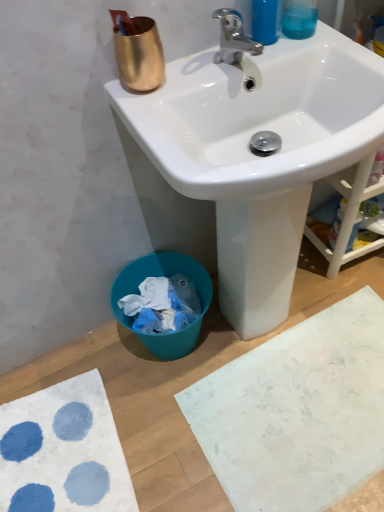
Question: Choose the correct answer: Is white textured bath mat at lower left, positioned as the second bath mat in right-to-left order, inside translucent blue liquid at upper right or outside it?

Choices:
 (A) inside
 (B) outside

Answer: (B)

Question: In terms of size, does white textured bath mat at lower left, positioned as the second bath mat in right-to-left order, appear bigger or smaller than translucent blue liquid at upper right?

Choices:
 (A) small
 (B) big

Answer: (B)

Question: Based on their relative distances, which object is farther from the white glossy sink at upper center?

Choices:
 (A) chrome metallic faucet at upper center
 (B) white textured bath mat at lower left, marked as the first bath mat in a left-to-right arrangement
 (C) translucent blue liquid at upper right
 (D) white matte bath mat at lower right, positioned as the 2th bath mat in left-to-right order

Answer: (B)

Question: Estimate the real-world distances between objects in this image. Which object is farther from the white textured bath mat at lower left, positioned as the second bath mat in right-to-left order?

Choices:
 (A) white glossy sink at upper center
 (B) white matte bath mat at lower right, which is the first bath mat from right to left
 (C) chrome metallic faucet at upper center
 (D) translucent blue liquid at upper right

Answer: (D)